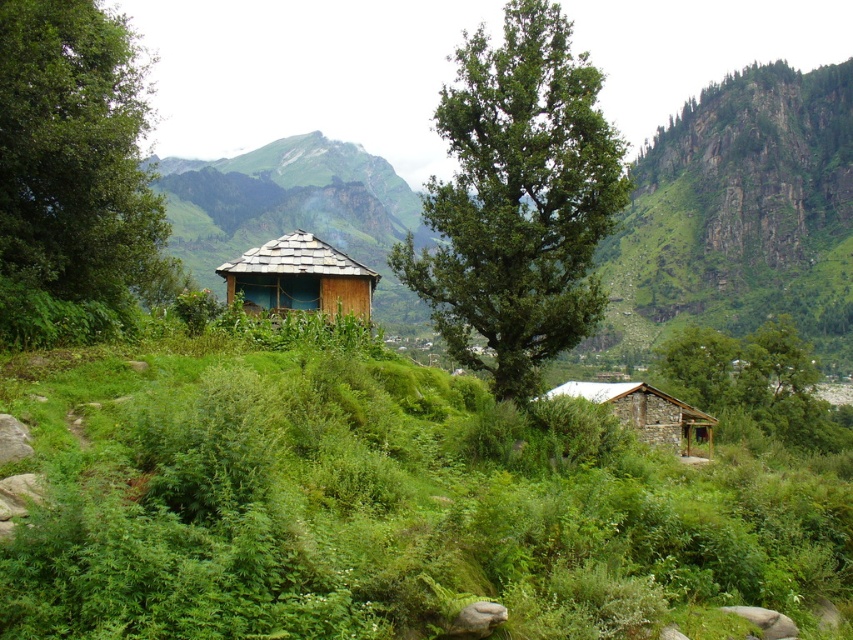
Consider the image. Is green leafy tree at lower right wider than wooden thatched hut at center?

Yes, green leafy tree at lower right is wider than wooden thatched hut at center.

Can you confirm if green leafy tree at lower right is smaller than wooden thatched hut at center?

No.

Who is more distant from viewer, (x=833, y=426) or (x=283, y=296)?

The point (x=833, y=426) is behind.

You are a GUI agent. You are given a task and a screenshot of the screen. Output one action in this format:
    pyautogui.click(x=<x>, y=<y>)
    Task: Click on the green leafy tree at lower right
    Image resolution: width=853 pixels, height=640 pixels.
    Given the screenshot: What is the action you would take?
    pyautogui.click(x=753, y=385)

Which of these two, green leafy tree at left or wooden thatched hut at center, stands shorter?

wooden thatched hut at center

Does green leafy tree at left have a lesser width compared to wooden thatched hut at center?

No.

Identify the location of green leafy tree at left. (71, 173).

Who is taller, green leafy grass at center or green leafy tree at lower right?

green leafy tree at lower right

Between green leafy grass at center and green leafy tree at lower right, which one is positioned lower?

green leafy tree at lower right is below.

Measure the distance between green leafy grass at center and camera.

green leafy grass at center is 32.03 feet away from camera.

Where is `green leafy grass at center`? This screenshot has width=853, height=640. green leafy grass at center is located at coordinates (384, 500).